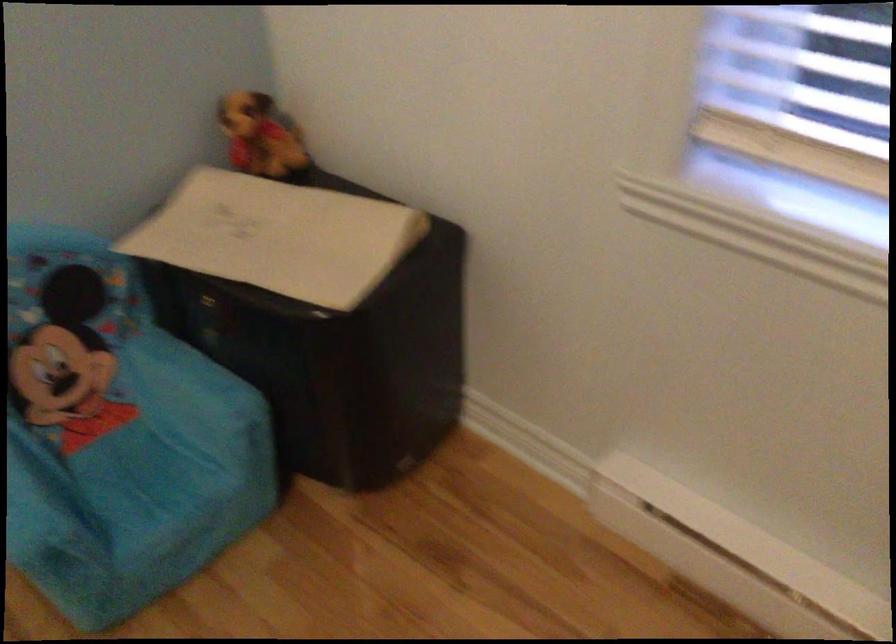
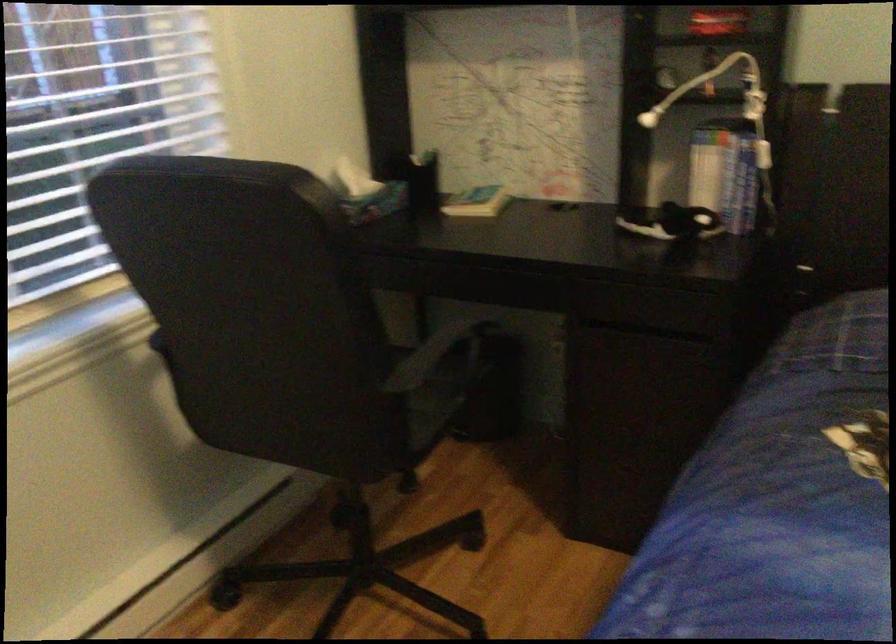
How did the camera likely rotate?

The rotation direction of the camera is right-down.